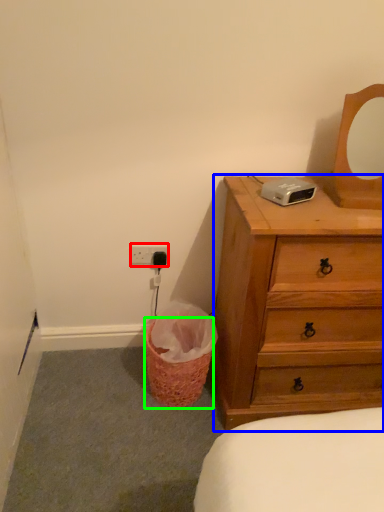
Question: Considering the real-world distances, which object is farthest from electric outlet (highlighted by a red box)? chest of drawers (highlighted by a blue box) or basket (highlighted by a green box)?

Choices:
 (A) chest of drawers
 (B) basket

Answer: (A)